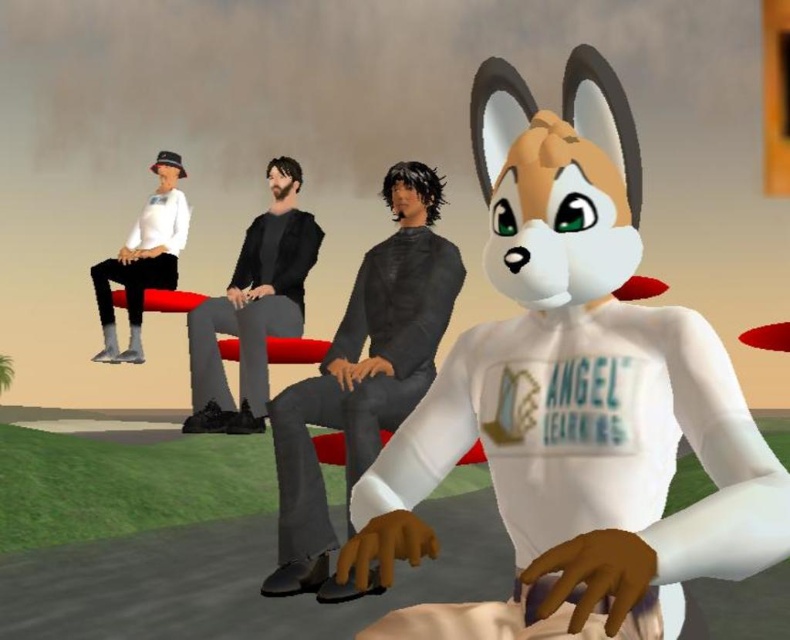
Question: From the image, what is the correct spatial relationship of white matte plush at center in relation to black matte pants at center?

Choices:
 (A) left
 (B) right

Answer: (B)

Question: Can you confirm if white matte plush at center is positioned above black matte pants at center?

Choices:
 (A) yes
 (B) no

Answer: (B)

Question: Estimate the real-world distances between objects in this image. Which object is farther from the dark gray hoodie at center?

Choices:
 (A) white matte shirt at left
 (B) white matte plush at center
 (C) black matte pants at center

Answer: (A)

Question: Which object appears farthest from the camera in this image?

Choices:
 (A) dark gray hoodie at center
 (B) white matte plush at center
 (C) white matte shirt at left
 (D) black matte pants at center

Answer: (C)

Question: Can you confirm if dark gray hoodie at center is thinner than white matte shirt at left?

Choices:
 (A) yes
 (B) no

Answer: (B)

Question: Which object is the closest to the white matte plush at center?

Choices:
 (A) white matte shirt at left
 (B) black matte pants at center
 (C) dark gray hoodie at center

Answer: (C)